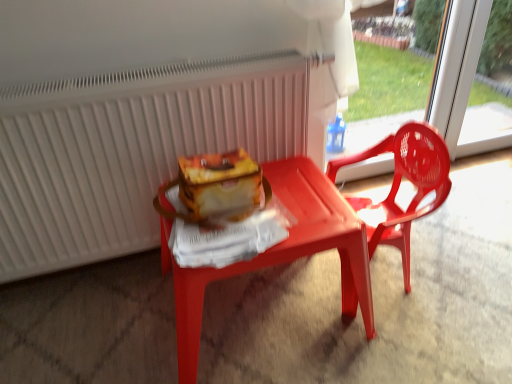
What is the approximate height of matte plastic table at center?

16.17 inches.

At what (x,y) coordinates should I click in order to perform the action: click on white matte radiator at upper center. Please return your answer as a coordinate pair (x, y). Looking at the image, I should click on pyautogui.click(x=130, y=151).

You are a GUI agent. You are given a task and a screenshot of the screen. Output one action in this format:
    pyautogui.click(x=<x>, y=<y>)
    Task: Click on the matte plastic table at center
    
    Given the screenshot: What is the action you would take?
    pyautogui.click(x=281, y=253)

Considering the relative sizes of matte plastic chair at right and white matte radiator at upper center in the image provided, is matte plastic chair at right shorter than white matte radiator at upper center?

Yes, matte plastic chair at right is shorter than white matte radiator at upper center.

Looking at this image, from a real-world perspective, does matte plastic chair at right stand above white matte radiator at upper center?

Actually, matte plastic chair at right is physically below white matte radiator at upper center in the real world.

Is matte plastic chair at right located outside white matte radiator at upper center?

matte plastic chair at right lies outside white matte radiator at upper center's area.

Considering the points (142, 162) and (372, 173), which point is in front, point (142, 162) or point (372, 173)?

The point (142, 162) is in front.

Which object is positioned more to the right, white matte radiator at upper center or transparent plastic screen door at upper right?

transparent plastic screen door at upper right.

Can you confirm if white matte radiator at upper center is thinner than transparent plastic screen door at upper right?

Incorrect, the width of white matte radiator at upper center is not less than that of transparent plastic screen door at upper right.

Locate an element on the screen. radiator that is above the transparent plastic screen door at upper right (from a real-world perspective) is located at coordinates click(x=130, y=151).

Find the location of `table below the transparent plastic screen door at upper right (from the image's perspective)`. table below the transparent plastic screen door at upper right (from the image's perspective) is located at coordinates (281, 253).

Is transparent plastic screen door at upper right positioned with its back to matte plastic table at center?

transparent plastic screen door at upper right is not turned away from matte plastic table at center.

Is transparent plastic screen door at upper right inside or outside of matte plastic table at center?

The correct answer is: outside.

Looking at this image, can you see transparent plastic screen door at upper right touching white matte radiator at upper center?

There is a gap between transparent plastic screen door at upper right and white matte radiator at upper center.

Between transparent plastic screen door at upper right and white matte radiator at upper center, which one has smaller size?

With smaller size is transparent plastic screen door at upper right.

How distant is transparent plastic screen door at upper right from white matte radiator at upper center?

transparent plastic screen door at upper right and white matte radiator at upper center are 36.12 inches apart from each other.

Which is more to the right, transparent plastic screen door at upper right or white matte radiator at upper center?

From the viewer's perspective, transparent plastic screen door at upper right appears more on the right side.

Is matte plastic chair at right not near transparent plastic screen door at upper right?

That's not correct — matte plastic chair at right is a little close to transparent plastic screen door at upper right.

Does matte plastic chair at right contain transparent plastic screen door at upper right?

Actually, transparent plastic screen door at upper right is outside matte plastic chair at right.

Would you say matte plastic chair at right is to the left or to the right of transparent plastic screen door at upper right in the picture?

matte plastic chair at right is to the left of transparent plastic screen door at upper right.

From the image's perspective, which is below, matte plastic chair at right or transparent plastic screen door at upper right?

From the image's view, matte plastic chair at right is below.

Is transparent plastic screen door at upper right aimed at matte plastic chair at right?

Yes, transparent plastic screen door at upper right faces towards matte plastic chair at right.

Consider the image. Who is bigger, transparent plastic screen door at upper right or matte plastic chair at right?

matte plastic chair at right.

Does point (347, 131) lie behind point (414, 199)?

Yes.

From the image's perspective, would you say white matte radiator at upper center is positioned over matte plastic chair at right?

Yes, from the image's perspective, white matte radiator at upper center is over matte plastic chair at right.

Considering the positions of objects white matte radiator at upper center and matte plastic chair at right in the image provided, who is more to the right, white matte radiator at upper center or matte plastic chair at right?

matte plastic chair at right.

Measure the distance from white matte radiator at upper center to matte plastic chair at right.

white matte radiator at upper center is 23.15 inches away from matte plastic chair at right.

Consider the image. From a real-world perspective, which is physically below, white matte radiator at upper center or matte plastic chair at right?

In real-world perspective, matte plastic chair at right is lower.

I want to click on chair below the white matte radiator at upper center (from a real-world perspective), so click(x=399, y=185).

Image resolution: width=512 pixels, height=384 pixels. What are the coordinates of `screen door located above the white matte radiator at upper center (from the image's perspective)` in the screenshot? It's located at (374, 130).

Based on their spatial positions, is white matte radiator at upper center or transparent plastic screen door at upper right closer to matte plastic chair at right?

transparent plastic screen door at upper right is closer to matte plastic chair at right.

Looking at the image, which one is located closer to matte plastic table at center, matte plastic chair at right or white matte radiator at upper center?

matte plastic chair at right.

Which object lies further to the anchor point transparent plastic screen door at upper right, matte plastic chair at right or matte plastic table at center?

matte plastic table at center is further to transparent plastic screen door at upper right.

Considering their positions, is matte plastic chair at right positioned further to white matte radiator at upper center than transparent plastic screen door at upper right?

Among the two, transparent plastic screen door at upper right is located further to white matte radiator at upper center.

Estimate the real-world distances between objects in this image. Which object is closer to white matte radiator at upper center, transparent plastic screen door at upper right or matte plastic chair at right?

Among the two, matte plastic chair at right is located nearer to white matte radiator at upper center.

Based on their spatial positions, is white matte radiator at upper center or matte plastic table at center further from transparent plastic screen door at upper right?

white matte radiator at upper center is positioned further to the anchor transparent plastic screen door at upper right.

Looking at the image, which one is located closer to transparent plastic screen door at upper right, matte plastic chair at right or white matte radiator at upper center?

matte plastic chair at right is positioned closer to the anchor transparent plastic screen door at upper right.

From the image, which object appears to be nearer to matte plastic table at center, matte plastic chair at right or transparent plastic screen door at upper right?

The object closer to matte plastic table at center is matte plastic chair at right.

This screenshot has height=384, width=512. What are the coordinates of `table located between white matte radiator at upper center and transparent plastic screen door at upper right in the left-right direction` in the screenshot? It's located at (281, 253).

This screenshot has height=384, width=512. I want to click on chair between transparent plastic screen door at upper right and matte plastic table at center vertically, so click(399, 185).

Where is `chair between white matte radiator at upper center and transparent plastic screen door at upper right from left to right`? chair between white matte radiator at upper center and transparent plastic screen door at upper right from left to right is located at coordinates (399, 185).

The height and width of the screenshot is (384, 512). What are the coordinates of `table situated between white matte radiator at upper center and matte plastic chair at right from left to right` in the screenshot? It's located at (281, 253).